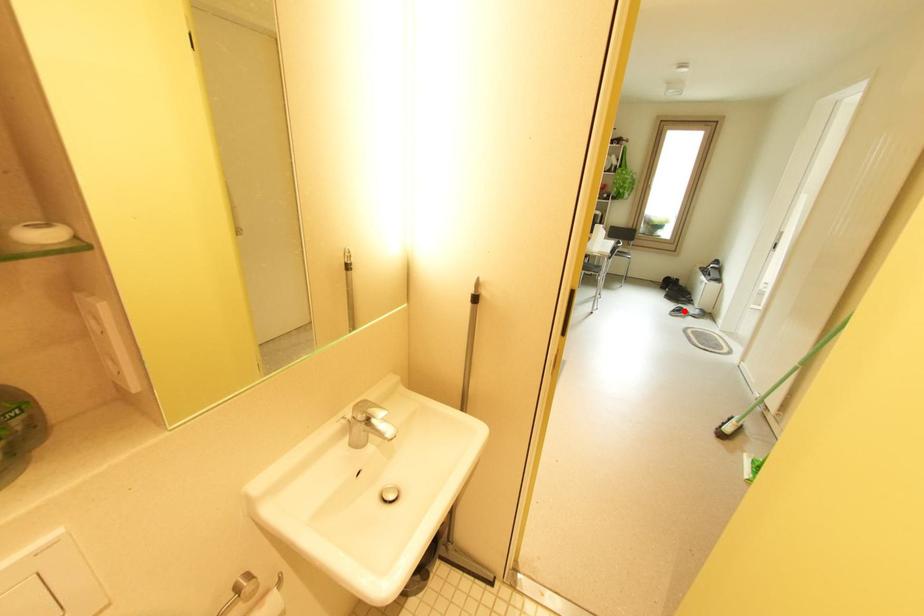
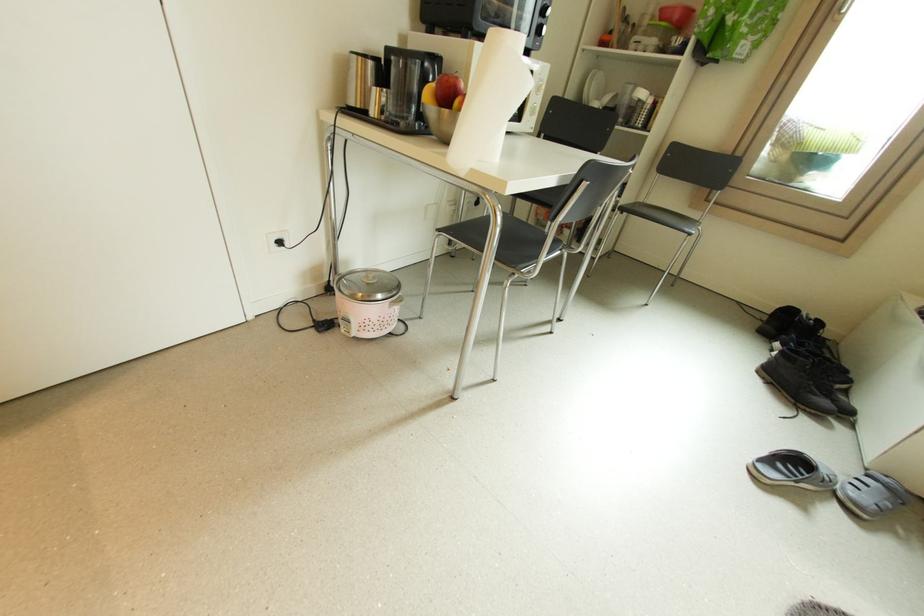
Question: I am providing you with two images of the same scene from different viewpoints. A red point is marked on the first image. Can you still see the location of the red point in image 2?

Choices:
 (A) Yes
 (B) No

Answer: (A)